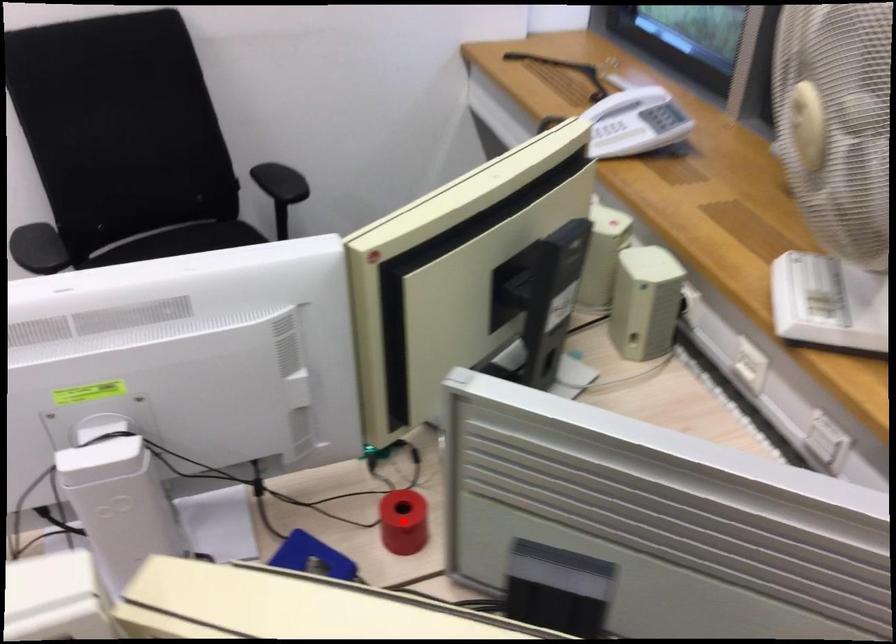
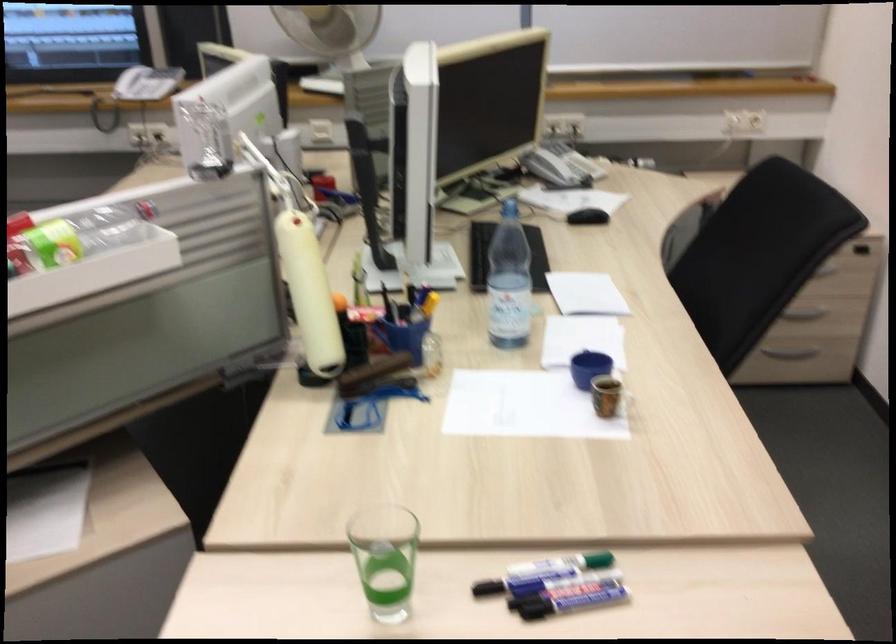
Question: I am providing you with two images of the same scene from different viewpoints. A red point is marked on the first image. Can you still see the location of the red point in image 2?

Choices:
 (A) Yes
 (B) No

Answer: (B)